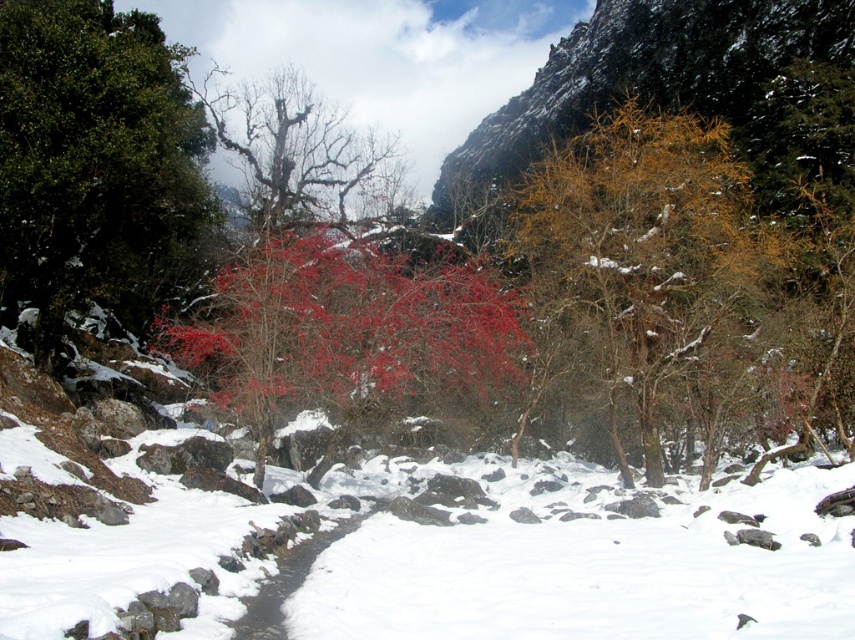
Question: Which of the following is the farthest from the observer?

Choices:
 (A) (780, 628)
 (B) (260, 157)

Answer: (B)

Question: Can you confirm if yellow-brown textured tree at center-right is bigger than bright red leaves at center?

Choices:
 (A) no
 (B) yes

Answer: (B)

Question: Considering the relative positions of yellow-brown textured tree at center-right and bare branches at upper center in the image provided, where is yellow-brown textured tree at center-right located with respect to bare branches at upper center?

Choices:
 (A) above
 (B) below

Answer: (B)

Question: In this image, where is green glossy tree at center located relative to bare branches at upper center?

Choices:
 (A) above
 (B) below

Answer: (B)

Question: Which of the following is the farthest from the observer?

Choices:
 (A) white fluffy snow at center
 (B) bare branches at upper center

Answer: (B)

Question: Which point appears farthest from the camera in this image?

Choices:
 (A) (69, 241)
 (B) (231, 109)
 (C) (551, 502)
 (D) (679, 179)

Answer: (B)